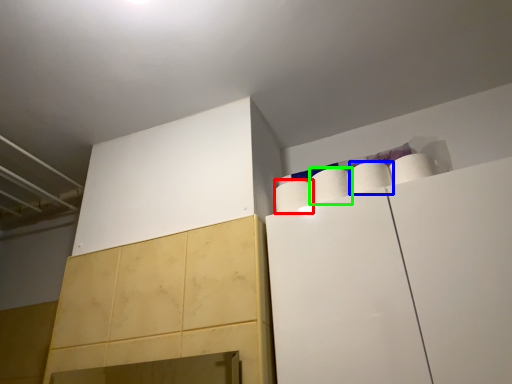
Question: Based on their relative distances, which object is nearer to paper towel (highlighted by a red box)? Choose from paper towel (highlighted by a blue box) and paper towel (highlighted by a green box).

Choices:
 (A) paper towel
 (B) paper towel

Answer: (B)